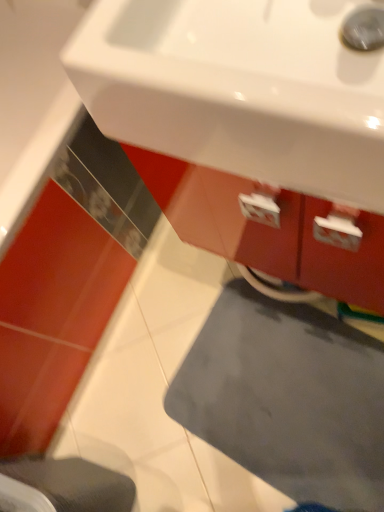
This screenshot has width=384, height=512. I want to click on empty space that is ontop of gray matte bath mat at lower center (from a real-world perspective), so click(x=280, y=392).